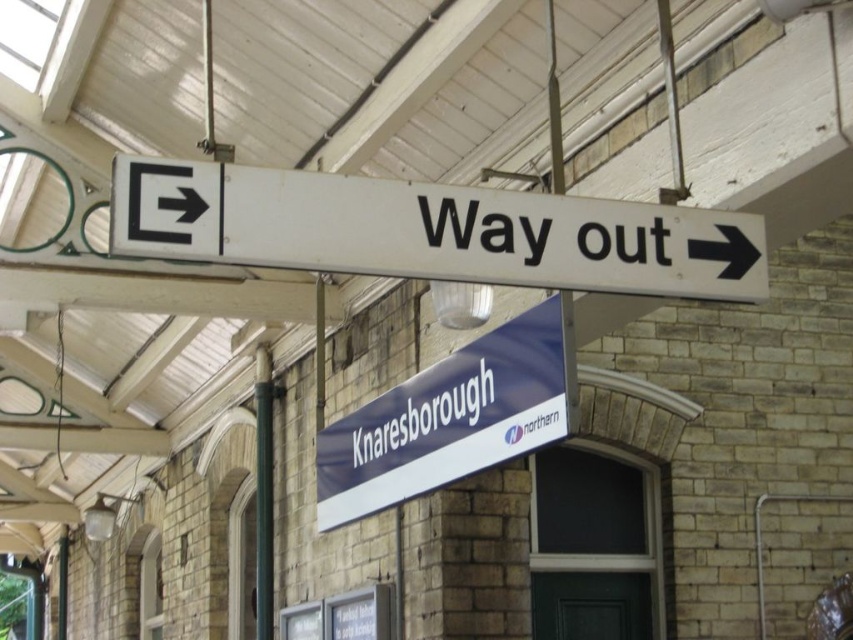
You are standing on the platform at Knaresborough station and notice two signs. The first is a white plastic sign at center and the second is a blue fabric sign at center. Which sign is located to the right when facing the signs?

→ The white plastic sign at center is positioned on the right side of blue fabric sign at center, so when facing the signs, the white plastic sign at center is on the right.

You are standing on the platform and want to exit the station. You see the white plastic sign at center and the blue fabric sign at center. Which sign is closer to you?

The white plastic sign at center is closer to the viewer than the blue fabric sign at center.

You are standing at the train station and see the point marked as point (x=431, y=230). What object is located at this point?

The point (x=431, y=230) corresponds to the white plastic sign at center.